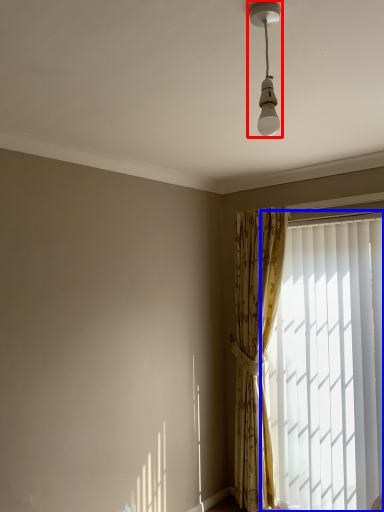
Question: Which of the following is the closest to the observer, lamp (highlighted by a red box) or window (highlighted by a blue box)?

Choices:
 (A) lamp
 (B) window

Answer: (A)